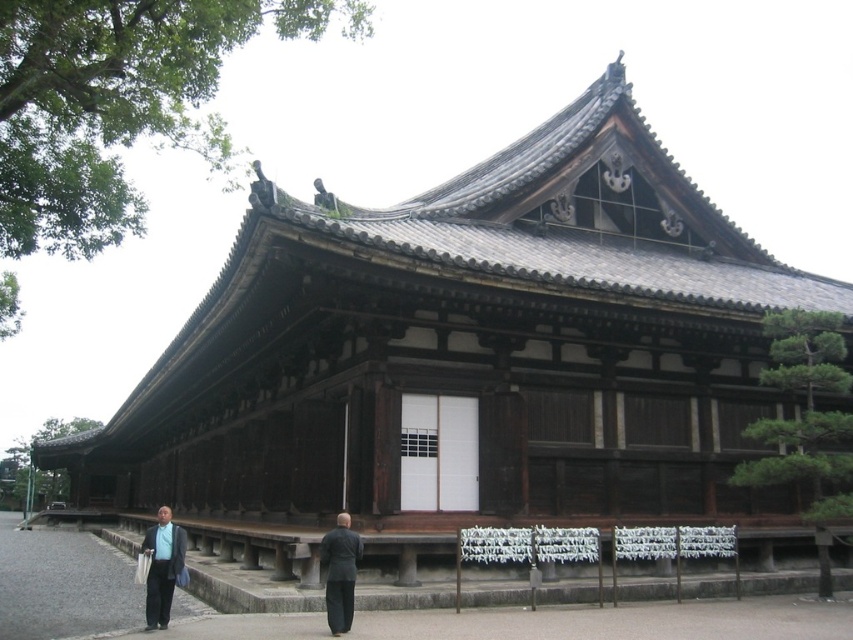
You are standing in front of the Japanese wooden structure and want to place a small offering between the two points, point [161,524] and point [329,589]. Which point is closer to you where you should place the offering first?

Point [161,524] is closer to you, so you should place the offering there first before moving to point [329,589].

You are attending a formal event at the temple and need to choose between the matte black suit at lower left and the dark gray suit at center. Based on their height, which one would be more appropriate to wear if you want to stand out visually?

The matte black suit at lower left is taller than the dark gray suit at center, so wearing the matte black suit at lower left would make you stand out more visually due to its greater height.

You are standing at the entrance of the temple and need to place a 5 meter long object between the matte black suit at lower left and the dark gray suit at center. Will there be enough space?

The distance between the matte black suit at lower left and the dark gray suit at center is 4.75 meters. Since the object is 5 meters long, it will not fit as the available space is shorter than the object.